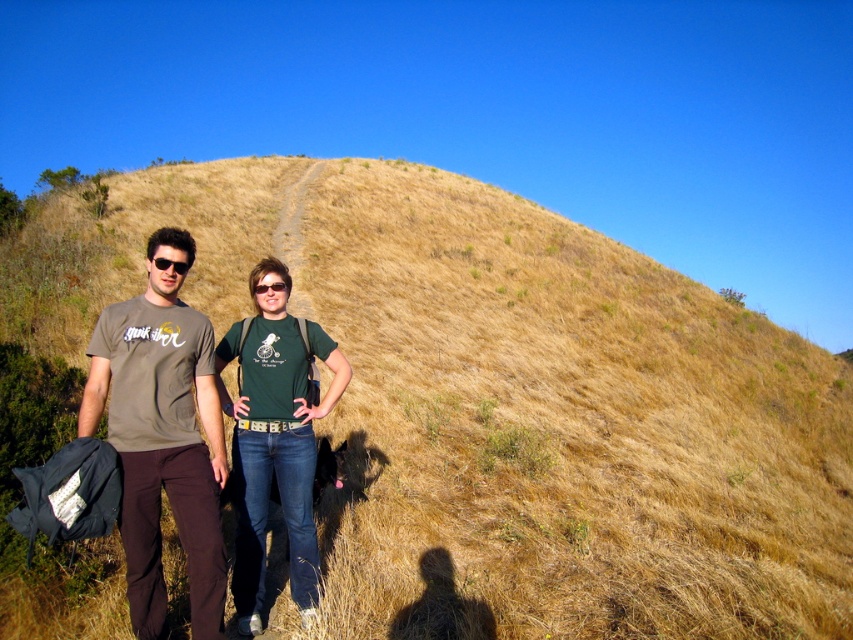
Question: From the image, what is the correct spatial relationship of black matte sunglasses at center in relation to black plastic sunglasses at left?

Choices:
 (A) left
 (B) right

Answer: (B)

Question: Does matte brown t-shirt at left have a greater width compared to black plastic sunglasses at left?

Choices:
 (A) no
 (B) yes

Answer: (B)

Question: Which object is positioned closest to the matte brown t-shirt at left?

Choices:
 (A) black matte sunglasses at center
 (B) black plastic sunglasses at left
 (C) green cotton shirt at center

Answer: (C)

Question: Which of the following is the closest to the observer?

Choices:
 (A) black plastic sunglasses at left
 (B) green cotton shirt at center

Answer: (A)

Question: Which object appears farthest from the camera in this image?

Choices:
 (A) black matte sunglasses at center
 (B) green cotton shirt at center
 (C) black plastic sunglasses at left

Answer: (A)

Question: Can you confirm if matte brown t-shirt at left is positioned above black matte sunglasses at center?

Choices:
 (A) no
 (B) yes

Answer: (A)